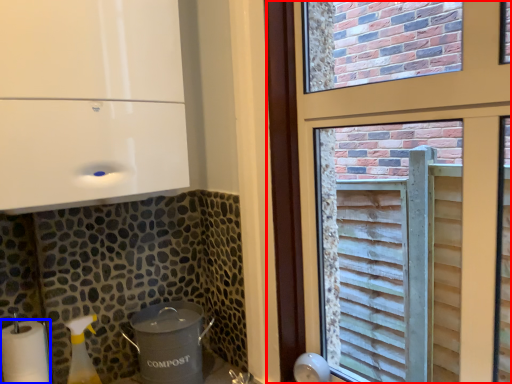
Question: Among these objects, which one is farthest to the camera, window (highlighted by a red box) or paper towel (highlighted by a blue box)?

Choices:
 (A) window
 (B) paper towel

Answer: (B)